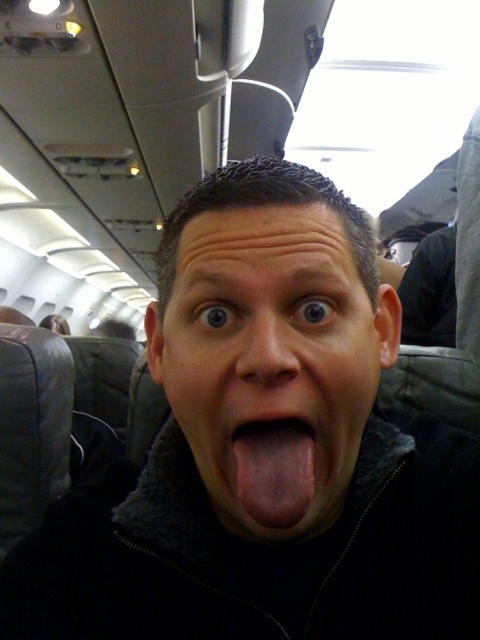
Please look at the image and locate the point at coordinates (269, 364). What object is positioned at that exact point?

The matte black face at center is located at point (269, 364).